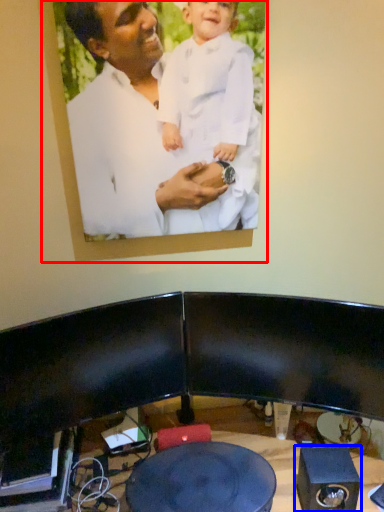
Question: Which object appears farthest to the camera in this image, picture frame (highlighted by a red box) or speaker (highlighted by a blue box)?

Choices:
 (A) picture frame
 (B) speaker

Answer: (B)